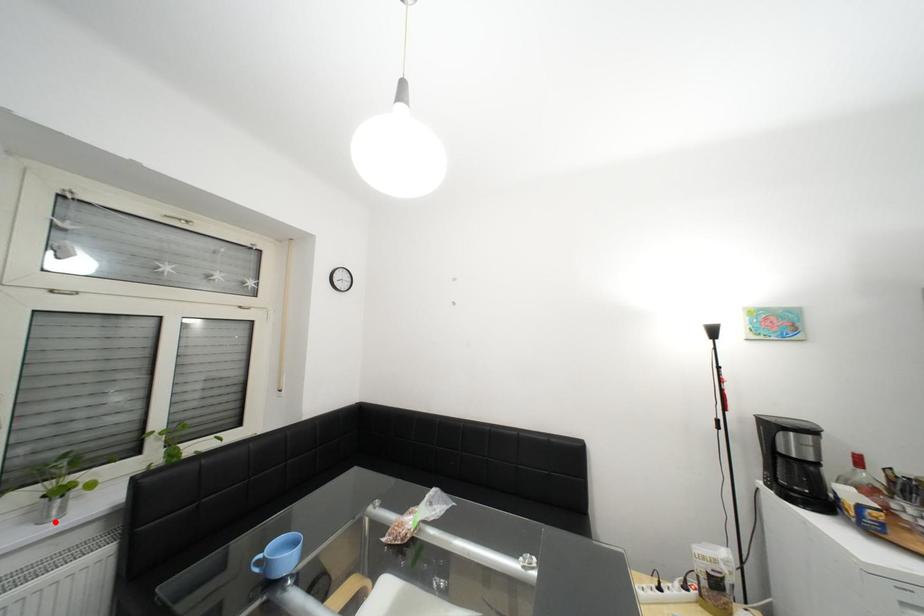
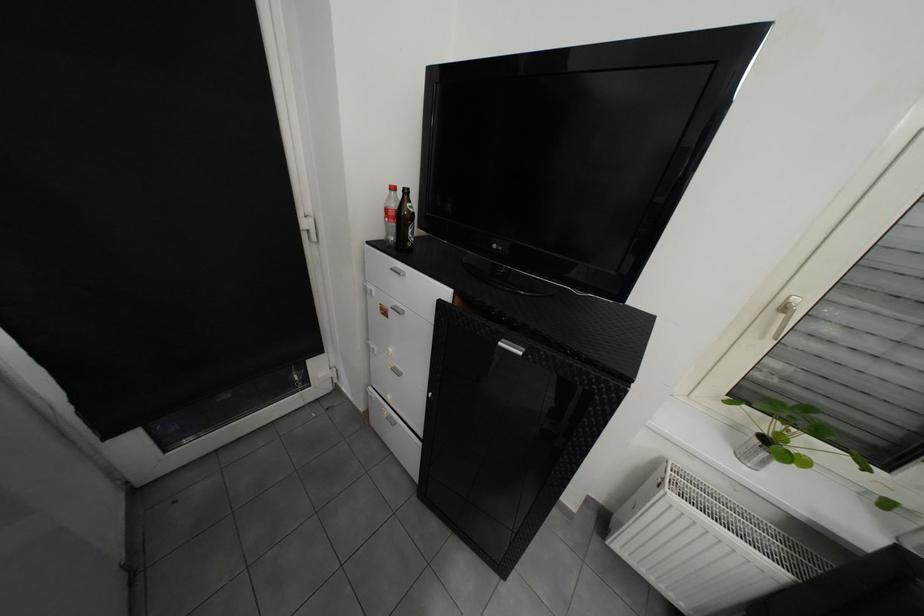
Where in the second image is the point corresponding to the highlighted location from the first image?

(754, 458)